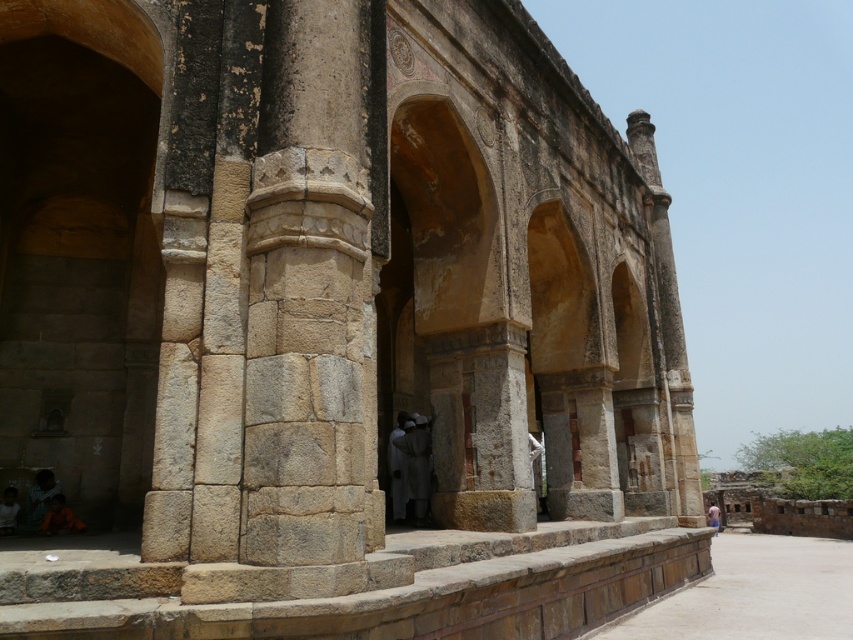
Between stone textured column at center and dark gray stone person at lower left, which one has more height?

stone textured column at center is taller.

Which is in front, point (286, 483) or point (39, 522)?

Point (286, 483) is in front.

Between point (326, 516) and point (35, 481), which one is positioned behind?

Point (35, 481)

Find the location of `stone textured column at center`. stone textured column at center is located at coordinates (306, 292).

Who is shorter, dark gray stone person at lower left or blue fabric person at center?

dark gray stone person at lower left is shorter.

Is dark gray stone person at lower left positioned before blue fabric person at center?

That is True.

The width and height of the screenshot is (853, 640). I want to click on dark gray stone person at lower left, so click(x=39, y=497).

Based on the photo, between white stone statue at center and blue fabric person at center, which one appears on the left side from the viewer's perspective?

From the viewer's perspective, white stone statue at center appears more on the left side.

Does white stone statue at center appear on the right side of blue fabric person at center?

In fact, white stone statue at center is to the left of blue fabric person at center.

At what (x,y) coordinates should I click in order to perform the action: click on white stone statue at center. Please return your answer as a coordinate pair (x, y). The width and height of the screenshot is (853, 640). Looking at the image, I should click on (413, 465).